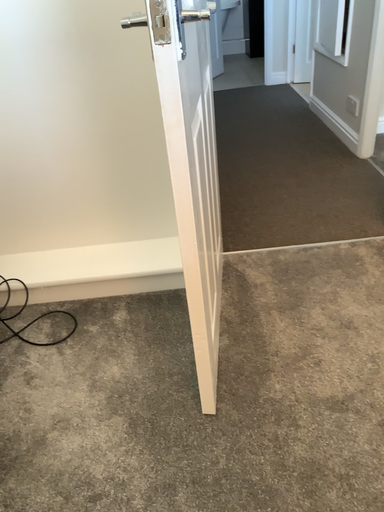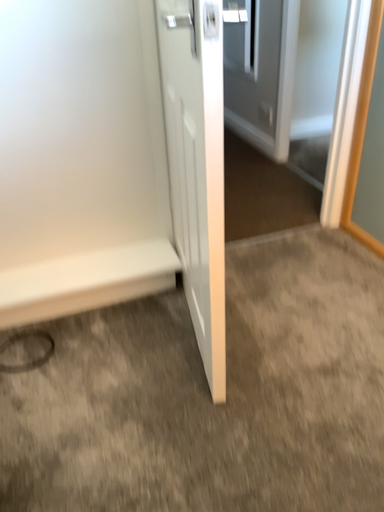
Question: How did the camera likely rotate when shooting the video?

Choices:
 (A) rotated right
 (B) rotated left

Answer: (A)